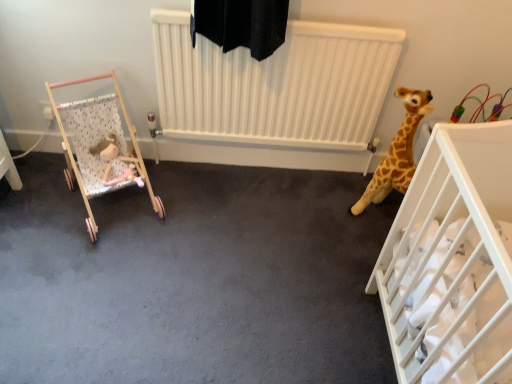
Locate an element on the screen. fluffy pink plush at left is located at coordinates (115, 162).

Where is `wooden stroller at left, positioned as the first infant bed in left-to-right order`? This screenshot has width=512, height=384. wooden stroller at left, positioned as the first infant bed in left-to-right order is located at coordinates (101, 146).

Is wooden stroller at left, arranged as the 2th infant bed when viewed from the right, at the back of fluffy pink plush at left?

Yes.

Does fluffy pink plush at left appear on the left side of wooden stroller at left, positioned as the first infant bed in left-to-right order?

No, fluffy pink plush at left is not to the left of wooden stroller at left, positioned as the first infant bed in left-to-right order.

In the scene shown: Measure the distance between fluffy pink plush at left and wooden stroller at left, arranged as the 2th infant bed when viewed from the right.

fluffy pink plush at left and wooden stroller at left, arranged as the 2th infant bed when viewed from the right, are 2.73 inches apart from each other.

From the picture: Does fluffy pink plush at left have a greater width compared to wooden stroller at left, arranged as the 2th infant bed when viewed from the right?

In fact, fluffy pink plush at left might be narrower than wooden stroller at left, arranged as the 2th infant bed when viewed from the right.

Is white plastic crib at right, which is the first infant bed in right-to-left order, oriented away from fluffy pink plush at left?

No, white plastic crib at right, which is the first infant bed in right-to-left order,'s orientation is not away from fluffy pink plush at left.

You are a GUI agent. You are given a task and a screenshot of the screen. Output one action in this format:
    pyautogui.click(x=<x>, y=<y>)
    Task: Click on the toy located on the left of white plastic crib at right, which is counted as the 2th infant bed, starting from the left
    The height and width of the screenshot is (384, 512).
    Given the screenshot: What is the action you would take?
    pyautogui.click(x=115, y=162)

Is point (418, 199) positioned behind point (110, 149)?

No, it is not.

Is white plastic crib at right, which is counted as the 2th infant bed, starting from the left, behind fluffy pink plush at left?

No, the depth of white plastic crib at right, which is counted as the 2th infant bed, starting from the left, is less than that of fluffy pink plush at left.

From a real-world perspective, which is physically below, white plastic crib at right, which is counted as the 2th infant bed, starting from the left, or wooden stroller at left, positioned as the first infant bed in left-to-right order?

In real-world perspective, wooden stroller at left, positioned as the first infant bed in left-to-right order, is lower.

Is white plastic crib at right, which is counted as the 2th infant bed, starting from the left, not close to wooden stroller at left, arranged as the 2th infant bed when viewed from the right?

Yes, white plastic crib at right, which is counted as the 2th infant bed, starting from the left, and wooden stroller at left, arranged as the 2th infant bed when viewed from the right, are quite far apart.

Is white plastic crib at right, which is counted as the 2th infant bed, starting from the left, in front of or behind wooden stroller at left, arranged as the 2th infant bed when viewed from the right, in the image?

white plastic crib at right, which is counted as the 2th infant bed, starting from the left, is in front of wooden stroller at left, arranged as the 2th infant bed when viewed from the right.

Is white plastic crib at right, which is the first infant bed in right-to-left order, oriented away from wooden stroller at left, positioned as the first infant bed in left-to-right order?

No, white plastic crib at right, which is the first infant bed in right-to-left order, is not facing away from wooden stroller at left, positioned as the first infant bed in left-to-right order.

How many degrees apart are the facing directions of fluffy pink plush at left and white plastic crib at right, which is the first infant bed in right-to-left order?

The facing directions of fluffy pink plush at left and white plastic crib at right, which is the first infant bed in right-to-left order, are 120 degrees apart.

From the image's perspective, which object appears higher, fluffy pink plush at left or white plastic crib at right, which is counted as the 2th infant bed, starting from the left?

fluffy pink plush at left is shown above in the image.

From a real-world perspective, is fluffy pink plush at left positioned above or below white plastic crib at right, which is the first infant bed in right-to-left order?

From a real-world perspective, fluffy pink plush at left is physically below white plastic crib at right, which is the first infant bed in right-to-left order.

Is wooden stroller at left, arranged as the 2th infant bed when viewed from the right, looking in the opposite direction of fluffy pink plush at left?

Correct, wooden stroller at left, arranged as the 2th infant bed when viewed from the right, is looking away from fluffy pink plush at left.

From the image's perspective, is wooden stroller at left, positioned as the first infant bed in left-to-right order, positioned above or below fluffy pink plush at left?

wooden stroller at left, positioned as the first infant bed in left-to-right order, is above fluffy pink plush at left.

From the picture: Looking at the image, does wooden stroller at left, arranged as the 2th infant bed when viewed from the right, seem bigger or smaller compared to fluffy pink plush at left?

Considering their sizes, wooden stroller at left, arranged as the 2th infant bed when viewed from the right, takes up more space than fluffy pink plush at left.

Considering the relative sizes of wooden stroller at left, arranged as the 2th infant bed when viewed from the right, and white plastic crib at right, which is counted as the 2th infant bed, starting from the left, in the image provided, is wooden stroller at left, arranged as the 2th infant bed when viewed from the right, bigger than white plastic crib at right, which is counted as the 2th infant bed, starting from the left,?

No.

Could you tell me if wooden stroller at left, positioned as the first infant bed in left-to-right order, is facing white plastic crib at right, which is the first infant bed in right-to-left order?

No, wooden stroller at left, positioned as the first infant bed in left-to-right order, does not turn towards white plastic crib at right, which is the first infant bed in right-to-left order.

Considering the relative positions of wooden stroller at left, arranged as the 2th infant bed when viewed from the right, and white plastic crib at right, which is the first infant bed in right-to-left order, in the image provided, is wooden stroller at left, arranged as the 2th infant bed when viewed from the right, to the right of white plastic crib at right, which is the first infant bed in right-to-left order, from the viewer's perspective?

No, wooden stroller at left, arranged as the 2th infant bed when viewed from the right, is not to the right of white plastic crib at right, which is the first infant bed in right-to-left order.

Is the position of wooden stroller at left, positioned as the first infant bed in left-to-right order, less distant than that of white plastic crib at right, which is the first infant bed in right-to-left order?

No, wooden stroller at left, positioned as the first infant bed in left-to-right order, is behind white plastic crib at right, which is the first infant bed in right-to-left order.

Identify the location of toy behind the wooden stroller at left, arranged as the 2th infant bed when viewed from the right. point(115,162).

Starting from the fluffy pink plush at left, which infant bed is the 2nd one in front? Please provide its 2D coordinates.

[(450, 212)]

Looking at this image, which object lies nearer to the anchor point white plastic crib at right, which is the first infant bed in right-to-left order, wooden stroller at left, arranged as the 2th infant bed when viewed from the right, or fluffy pink plush at left?

Based on the image, wooden stroller at left, arranged as the 2th infant bed when viewed from the right, appears to be nearer to white plastic crib at right, which is the first infant bed in right-to-left order.

In the scene shown: Looking at the image, which one is located further to wooden stroller at left, positioned as the first infant bed in left-to-right order, white plastic crib at right, which is the first infant bed in right-to-left order, or fluffy pink plush at left?

Among the two, white plastic crib at right, which is the first infant bed in right-to-left order, is located further to wooden stroller at left, positioned as the first infant bed in left-to-right order.

Looking at the image, which one is located closer to fluffy pink plush at left, white plastic crib at right, which is the first infant bed in right-to-left order, or wooden stroller at left, arranged as the 2th infant bed when viewed from the right?

wooden stroller at left, arranged as the 2th infant bed when viewed from the right, is positioned closer to the anchor fluffy pink plush at left.

Looking at the image, which one is located closer to wooden stroller at left, arranged as the 2th infant bed when viewed from the right, fluffy pink plush at left or white plastic crib at right, which is counted as the 2th infant bed, starting from the left?

fluffy pink plush at left lies closer to wooden stroller at left, arranged as the 2th infant bed when viewed from the right, than the other object.

Looking at the image, which one is located further to white plastic crib at right, which is the first infant bed in right-to-left order, fluffy pink plush at left or wooden stroller at left, positioned as the first infant bed in left-to-right order?

fluffy pink plush at left lies further to white plastic crib at right, which is the first infant bed in right-to-left order, than the other object.

Considering their positions, is wooden stroller at left, positioned as the first infant bed in left-to-right order, positioned closer to fluffy pink plush at left than white plastic crib at right, which is counted as the 2th infant bed, starting from the left?

Based on the image, wooden stroller at left, positioned as the first infant bed in left-to-right order, appears to be nearer to fluffy pink plush at left.

Find the location of a particular element. Image resolution: width=512 pixels, height=384 pixels. toy between wooden stroller at left, arranged as the 2th infant bed when viewed from the right, and white plastic crib at right, which is the first infant bed in right-to-left order, in the horizontal direction is located at coordinates (115, 162).